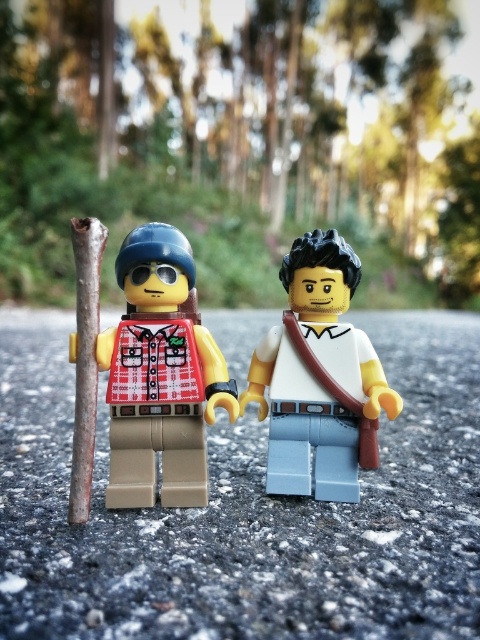
Between point (139, 289) and point (276, 472), which one is positioned in front?

Point (139, 289)

Which is more to the left, matte yellow figure at left or white matte shirt at center?

matte yellow figure at left

The height and width of the screenshot is (640, 480). What are the coordinates of `matte yellow figure at left` in the screenshot? It's located at (159, 374).